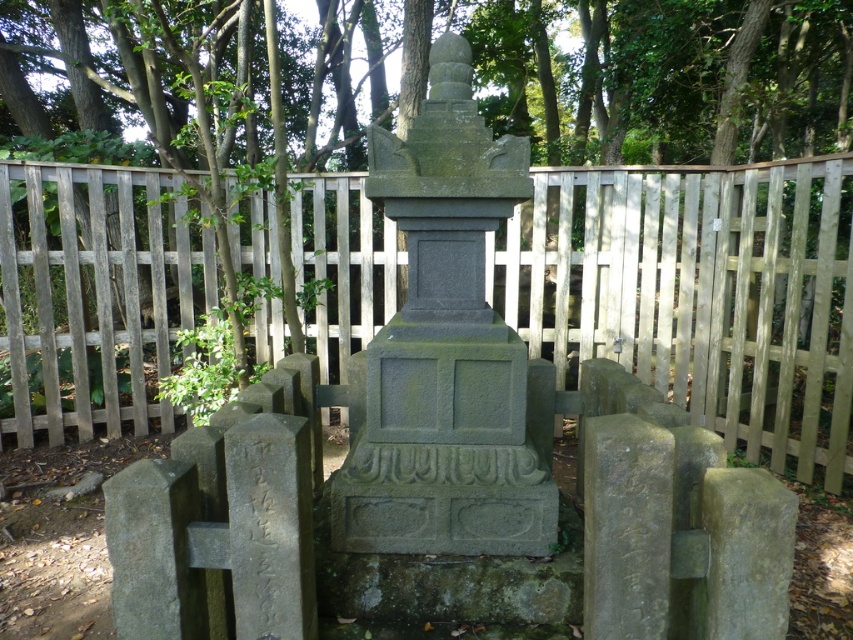
Question: Can you confirm if wooden fence at center is thinner than gray stone monument at center?

Choices:
 (A) no
 (B) yes

Answer: (B)

Question: From the image, what is the correct spatial relationship of wooden fence at center in relation to gray stone monument at center?

Choices:
 (A) right
 (B) left

Answer: (A)

Question: Which point appears closest to the camera in this image?

Choices:
 (A) (407, 516)
 (B) (57, 236)

Answer: (A)

Question: Observing the image, what is the correct spatial positioning of wooden fence at center in reference to gray stone monument at center?

Choices:
 (A) below
 (B) above

Answer: (B)